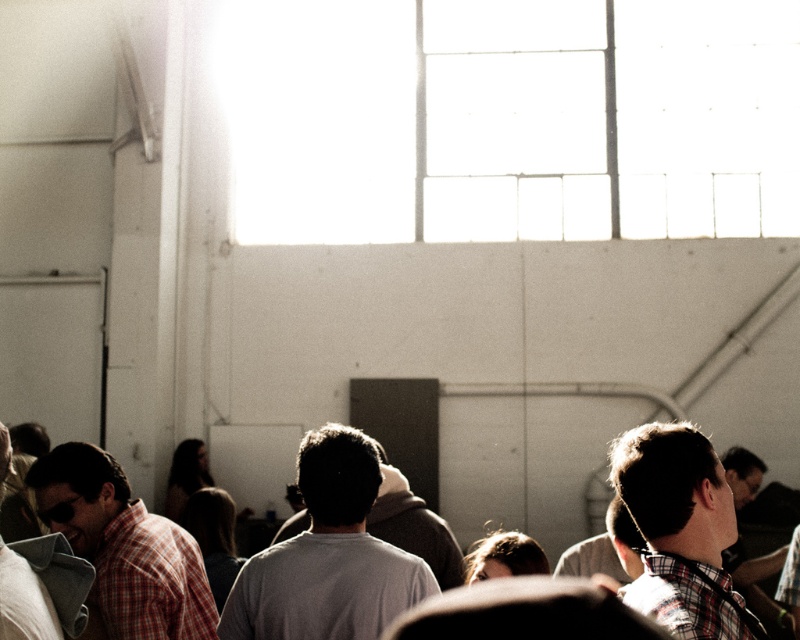
Does gray cotton shirt at center have a larger size compared to plaid shirt at left?

Indeed, gray cotton shirt at center has a larger size compared to plaid shirt at left.

Based on the photo, between gray cotton shirt at center and plaid shirt at left, which one has less height?

gray cotton shirt at center

You are a GUI agent. You are given a task and a screenshot of the screen. Output one action in this format:
    pyautogui.click(x=<x>, y=<y>)
    Task: Click on the gray cotton shirt at center
    This screenshot has width=800, height=640.
    Given the screenshot: What is the action you would take?
    pyautogui.click(x=102, y=589)

Who is positioned more to the right, plaid cotton shirt at right or matte gray shirt at lower left?

plaid cotton shirt at right is more to the right.

Is plaid cotton shirt at right smaller than matte gray shirt at lower left?

No.

Between point (658, 468) and point (60, 621), which one is positioned behind?

The point (60, 621) is behind.

At what (x,y) coordinates should I click in order to perform the action: click on plaid cotton shirt at right. Please return your answer as a coordinate pair (x, y). This screenshot has width=800, height=640. Looking at the image, I should click on (680, 531).

Is gray cotton shirt at center thinner than matte gray shirt at lower left?

No, gray cotton shirt at center is not thinner than matte gray shirt at lower left.

What do you see at coordinates (102, 589) in the screenshot? I see `gray cotton shirt at center` at bounding box center [102, 589].

Where is `gray cotton shirt at center`? This screenshot has width=800, height=640. gray cotton shirt at center is located at coordinates (102, 589).